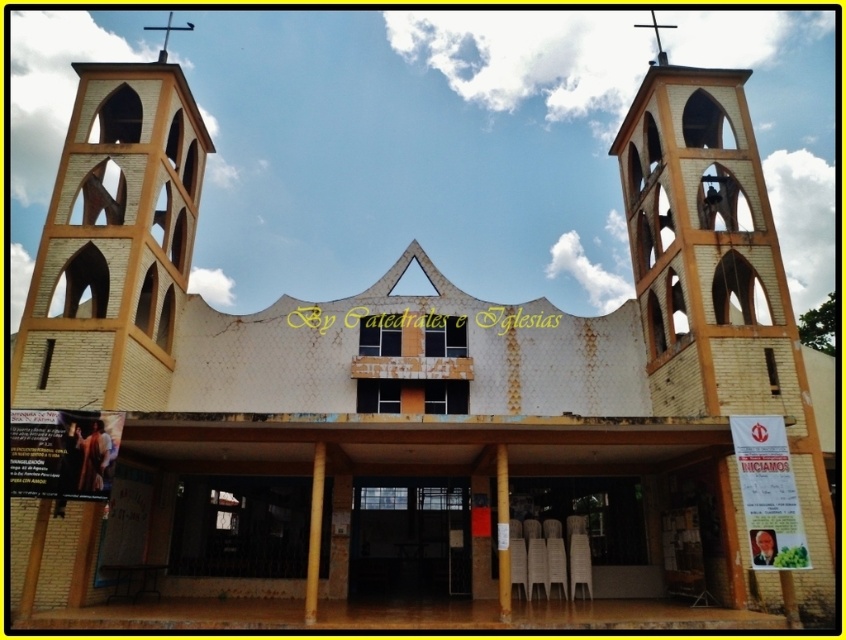
Can you confirm if yellow brick bell tower at upper center is wider than smooth gold cross at upper center?

Yes, yellow brick bell tower at upper center is wider than smooth gold cross at upper center.

Is yellow brick bell tower at upper center smaller than smooth gold cross at upper center?

Incorrect, yellow brick bell tower at upper center is not smaller in size than smooth gold cross at upper center.

Does point (165, 307) lie in front of point (651, 19)?

Yes, point (165, 307) is in front of point (651, 19).

Where is `yellow brick bell tower at upper center`? The image size is (846, 640). yellow brick bell tower at upper center is located at coordinates (114, 243).